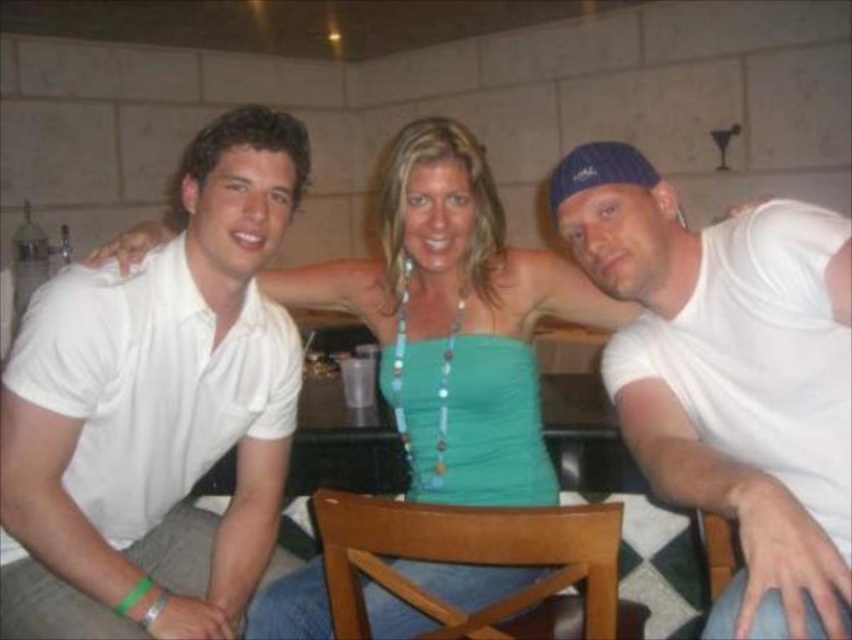
You are a photographer at the event and want to ensure that the white matte tank top at right and the brown wooden chair at center are both visible in your photo. Based on their heights, which object should you focus on first to ensure both are in frame?

The white matte tank top at right is taller than the brown wooden chair at center, so focusing on the white matte tank top at right first will help ensure both are visible in the frame.

You are standing in the bar area and want to take a photo of the point at coordinates (419, 593). The camera you are using has a minimum focus distance of 3.5 feet. Will the camera be able to focus on the point?

The point at coordinates (419, 593) is 3.67 feet away from the camera, which is beyond the minimum focus distance of 3.5 feet. Therefore, the camera should be able to focus on the point.